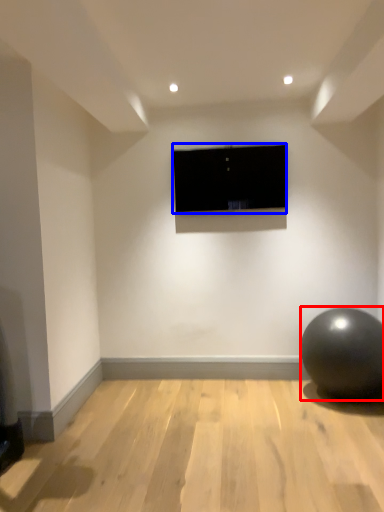
Question: Which point is closer to the camera, ball (highlighted by a red box) or television (highlighted by a blue box)?

Choices:
 (A) ball
 (B) television

Answer: (A)